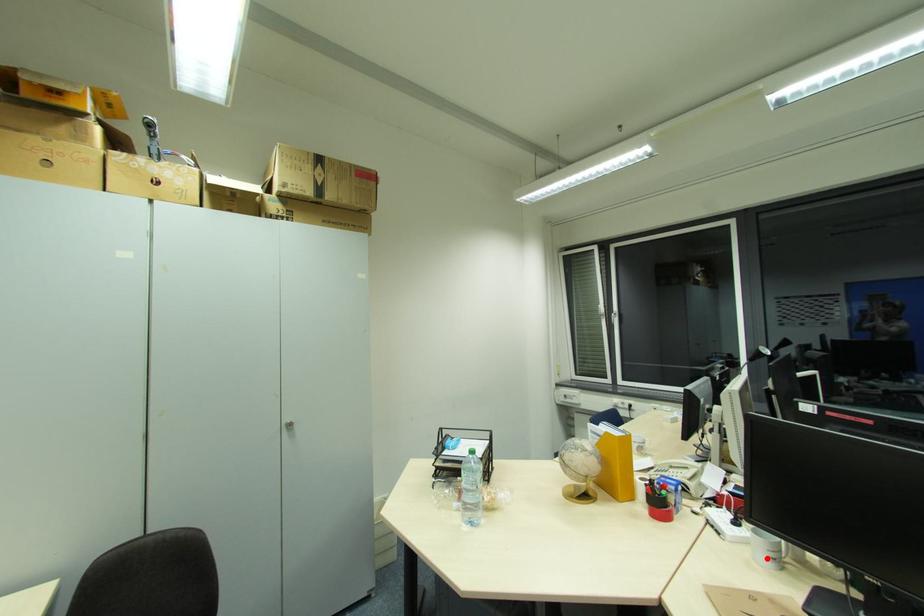
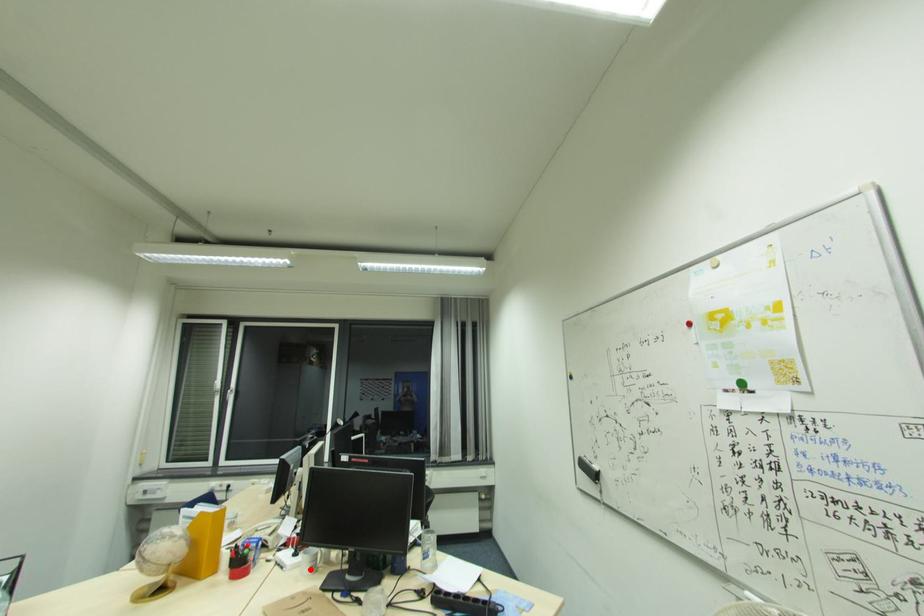
I am providing you with two images of the same scene from different viewpoints. A red point is marked on the first image and another point is marked on the second image. Are the points marked in image1 and image2 representing the same 3D position?

Yes